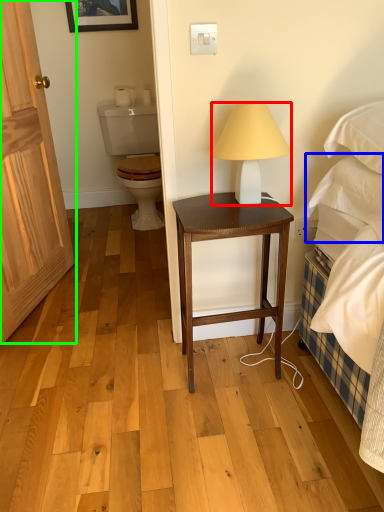
Question: Which object is positioned closest to lamp (highlighted by a red box)? Select from pillow (highlighted by a blue box) and door (highlighted by a green box).

Choices:
 (A) pillow
 (B) door

Answer: (A)